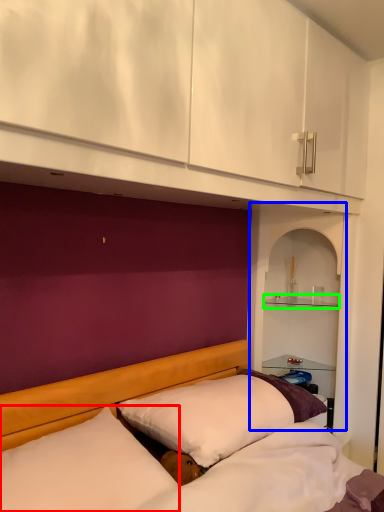
Question: Which object is positioned farthest from pillow (highlighted by a red box)? Select from shelf (highlighted by a blue box) and shelf (highlighted by a green box).

Choices:
 (A) shelf
 (B) shelf

Answer: (B)